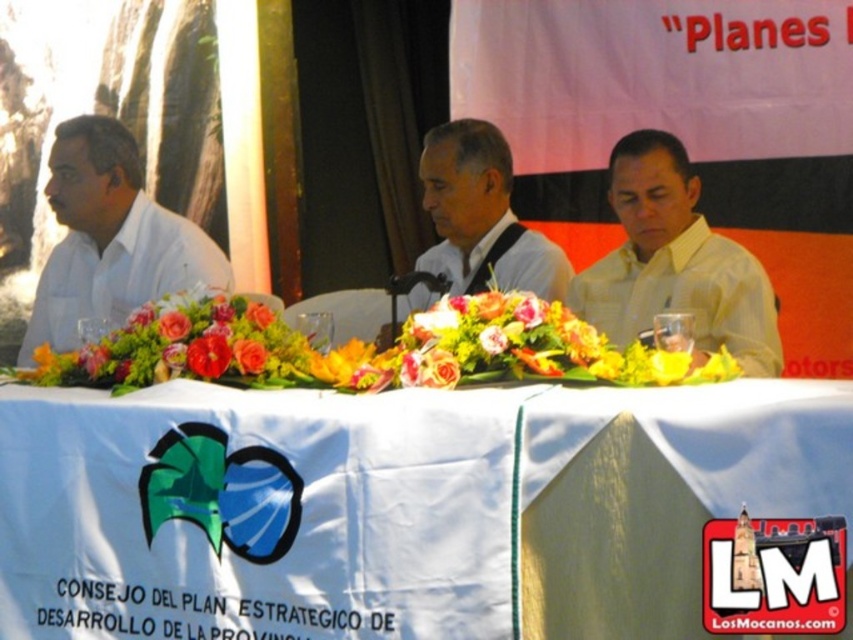
What do you see at coordinates (396, 508) in the screenshot?
I see `white cloth at center` at bounding box center [396, 508].

In the scene shown: Measure the distance between white cloth at center and camera.

2.14 meters

Is point (131, 605) less distant than point (126, 157)?

Yes, it is in front of point (126, 157).

The image size is (853, 640). I want to click on white cloth at center, so coord(396,508).

Which of these two, yellow textured shirt at center or white matte shirt at center, stands taller?

white matte shirt at center

Is yellow textured shirt at center thinner than white matte shirt at center?

Correct, yellow textured shirt at center's width is less than white matte shirt at center's.

Who is more forward, (643, 307) or (498, 218)?

Point (643, 307) is in front.

The image size is (853, 640). Identify the location of yellow textured shirt at center. (675, 262).

Between point (611, 180) and point (152, 252), which one is positioned in front?

Positioned in front is point (611, 180).

Which of these two, yellow textured shirt at center or white matte shirt at left, stands shorter?

yellow textured shirt at center

Who is more distant from viewer, (605, 324) or (91, 188)?

Point (91, 188)

This screenshot has width=853, height=640. Identify the location of yellow textured shirt at center. (675, 262).